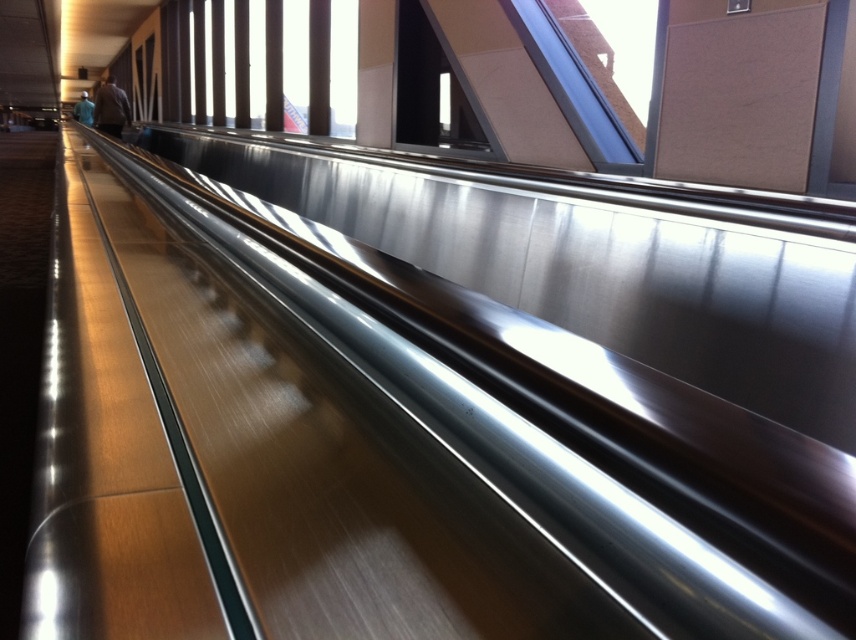
Question: Which point appears farthest from the camera in this image?

Choices:
 (A) (125, 99)
 (B) (78, 116)

Answer: (B)

Question: Does dark blue shirt at upper left have a larger size compared to light blue shirt at upper left?

Choices:
 (A) no
 (B) yes

Answer: (A)

Question: Is dark blue shirt at upper left closer to the viewer compared to light blue shirt at upper left?

Choices:
 (A) yes
 (B) no

Answer: (A)

Question: Which object is farther from the camera taking this photo?

Choices:
 (A) dark blue shirt at upper left
 (B) light blue shirt at upper left

Answer: (B)

Question: Is dark blue shirt at upper left behind light blue shirt at upper left?

Choices:
 (A) yes
 (B) no

Answer: (B)

Question: Which of the following is the farthest from the observer?

Choices:
 (A) dark blue shirt at upper left
 (B) light blue shirt at upper left

Answer: (B)